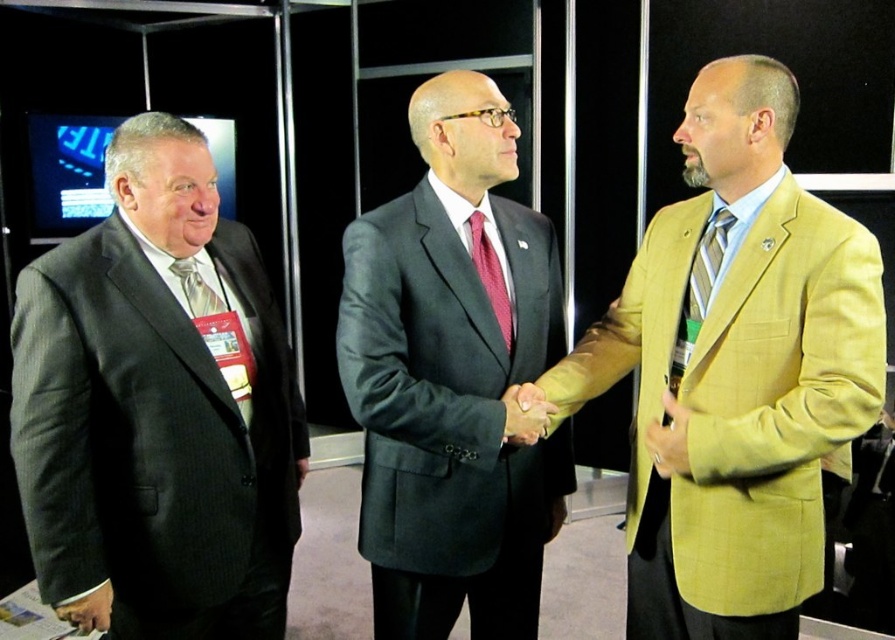
Does point (190, 284) lie in front of point (732, 216)?

No, (190, 284) is behind (732, 216).

Is matte silver tie at left positioned in front of striped silk tie at center?

No, matte silver tie at left is behind striped silk tie at center.

Find the location of a particular element. matte silver tie at left is located at coordinates pyautogui.click(x=219, y=332).

Who is higher up, matte black suit at left or light olive-green suit at center?

light olive-green suit at center

Which of these two, matte black suit at left or light olive-green suit at center, stands taller?

Standing taller between the two is light olive-green suit at center.

Is point (121, 440) positioned before point (714, 392)?

Yes, it is.

Where is `matte black suit at left`? matte black suit at left is located at coordinates (158, 408).

Which is below, dark gray suit at center or smooth tan hand at center?

A: Positioned lower is smooth tan hand at center.

Between dark gray suit at center and smooth tan hand at center, which one has less height?

Standing shorter between the two is smooth tan hand at center.

I want to click on dark gray suit at center, so click(x=453, y=376).